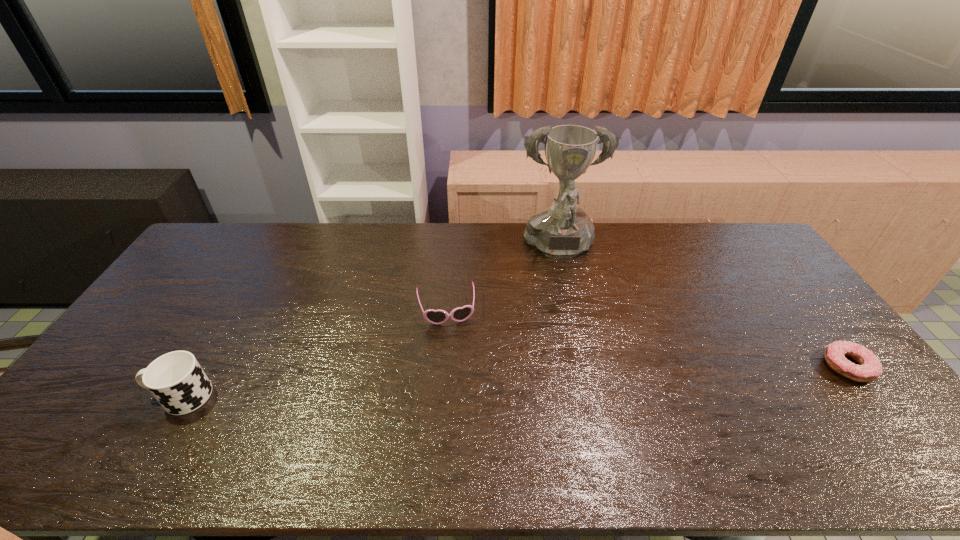
The height and width of the screenshot is (540, 960). What are the coordinates of `object positioned at the right edge` in the screenshot? It's located at coord(869,369).

In order to click on free point at the far edge in this screenshot , I will do `click(602, 254)`.

Find the location of a particular element. free space at the near edge is located at coordinates (489, 423).

In the image, there is a desktop. What are the coordinates of `vacant area at the right edge` in the screenshot? It's located at (757, 304).

This screenshot has height=540, width=960. Identify the location of vacant area at the far left corner. (212, 230).

You are a GUI agent. You are given a task and a screenshot of the screen. Output one action in this format:
    pyautogui.click(x=<x>, y=<y>)
    Task: Click on the free space at the far right corner of the desktop
    The image size is (960, 540).
    Given the screenshot: What is the action you would take?
    pyautogui.click(x=720, y=228)

Find the location of a particular element. The height and width of the screenshot is (540, 960). blank space at the near right corner is located at coordinates (850, 399).

At what (x,y) coordinates should I click in order to perform the action: click on free space between the shortest object and the second tallest object. Please return your answer as a coordinate pair (x, y). Looking at the image, I should click on (515, 381).

Image resolution: width=960 pixels, height=540 pixels. I want to click on vacant region between the third nearest object and the second tallest object, so click(x=314, y=353).

This screenshot has width=960, height=540. What are the coordinates of `empty location between the cup and the rightmost object` in the screenshot? It's located at (515, 381).